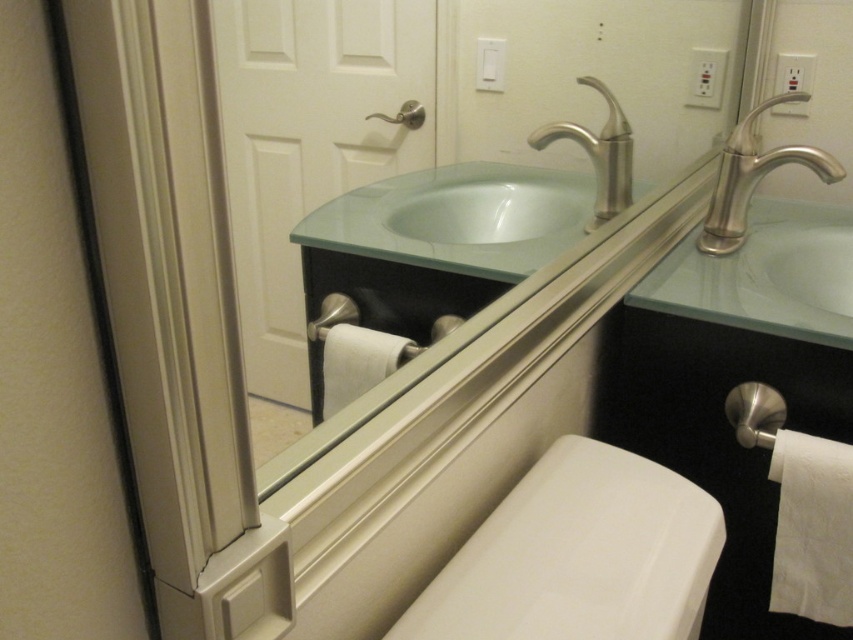
Is point (849, 605) less distant than point (334, 356)?

No, it is behind (334, 356).

Who is positioned more to the right, white textured toilet paper at lower right or white matte toilet paper at lower center?

From the viewer's perspective, white textured toilet paper at lower right appears more on the right side.

Find the location of `white textured toilet paper at lower right`. white textured toilet paper at lower right is located at coordinates (811, 529).

Can you confirm if white textured toilet paper at lower right is positioned below brushed nickel faucet at upper center?

Indeed, white textured toilet paper at lower right is positioned under brushed nickel faucet at upper center.

Between point (846, 490) and point (535, 134), which one is positioned behind?

Point (535, 134)

Locate an element on the screen. The width and height of the screenshot is (853, 640). white textured toilet paper at lower right is located at coordinates (811, 529).

Can you confirm if white glossy toilet bowl at lower center is bigger than satin nickel faucet at upper right?

No.

Can you confirm if white glossy toilet bowl at lower center is positioned above satin nickel faucet at upper right?

Incorrect, white glossy toilet bowl at lower center is not positioned above satin nickel faucet at upper right.

Is point (695, 588) less distant than point (741, 236)?

Yes, it is in front of point (741, 236).

I want to click on white glossy toilet bowl at lower center, so click(x=579, y=556).